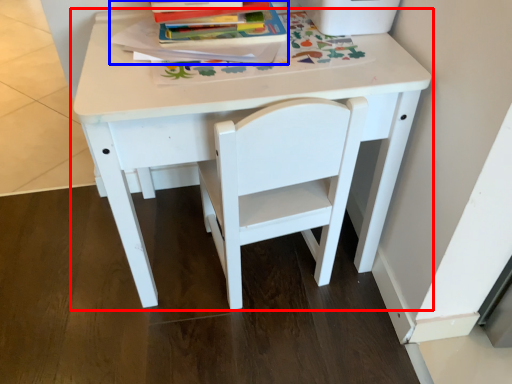
Question: Among these objects, which one is farthest to the camera, table (highlighted by a red box) or paperback book (highlighted by a blue box)?

Choices:
 (A) table
 (B) paperback book

Answer: (B)